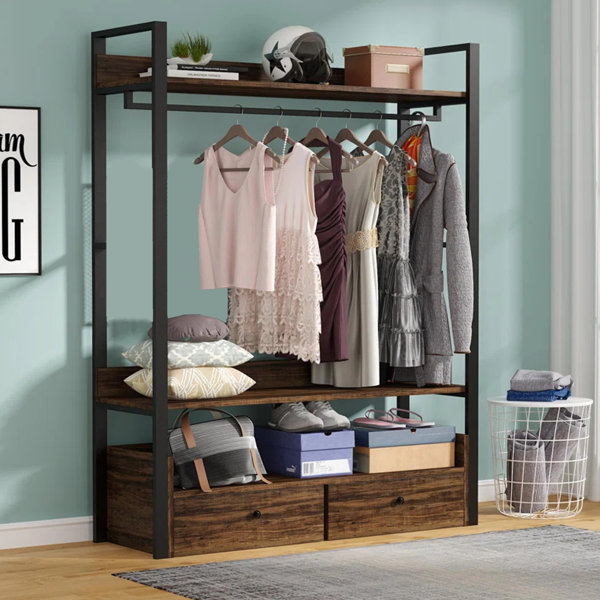
I want to click on clothes hanging on hangars, so click(235, 219), click(290, 215), click(328, 211), click(358, 206), click(389, 225), click(435, 218).